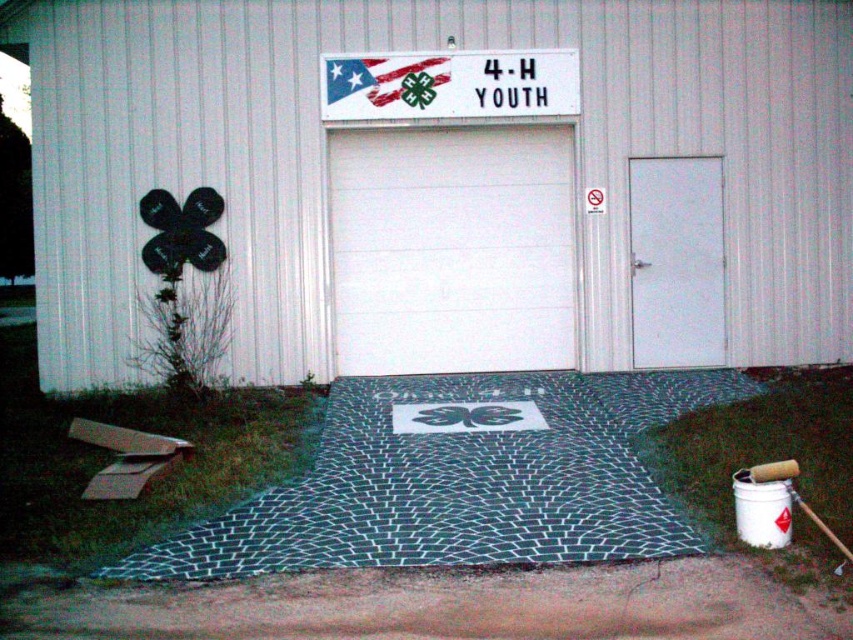
Can you confirm if white smooth garage door at center is shorter than white paper sign at upper center?

In fact, white smooth garage door at center may be taller than white paper sign at upper center.

This screenshot has width=853, height=640. What are the coordinates of `white smooth garage door at center` in the screenshot? It's located at 451,248.

Find the location of a particular element. The height and width of the screenshot is (640, 853). white smooth garage door at center is located at coordinates (451, 248).

Between point (701, 188) and point (498, 68), which one is positioned behind?

The point (701, 188) is more distant.

Is white matte garage door at center positioned in front of white paper sign at upper center?

No, white matte garage door at center is further to the viewer.

Is point (82, 228) farther from viewer compared to point (390, 68)?

No, (82, 228) is closer to viewer.

You are a GUI agent. You are given a task and a screenshot of the screen. Output one action in this format:
    pyautogui.click(x=<x>, y=<y>)
    Task: Click on the white matte garage door at center
    This screenshot has width=853, height=640.
    Given the screenshot: What is the action you would take?
    pyautogui.click(x=450, y=179)

Which is in front, point (142, 13) or point (560, 456)?

Positioned in front is point (560, 456).

Who is lower down, white matte garage door at center or black woven mat at center?

black woven mat at center

The width and height of the screenshot is (853, 640). I want to click on white matte garage door at center, so click(x=450, y=179).